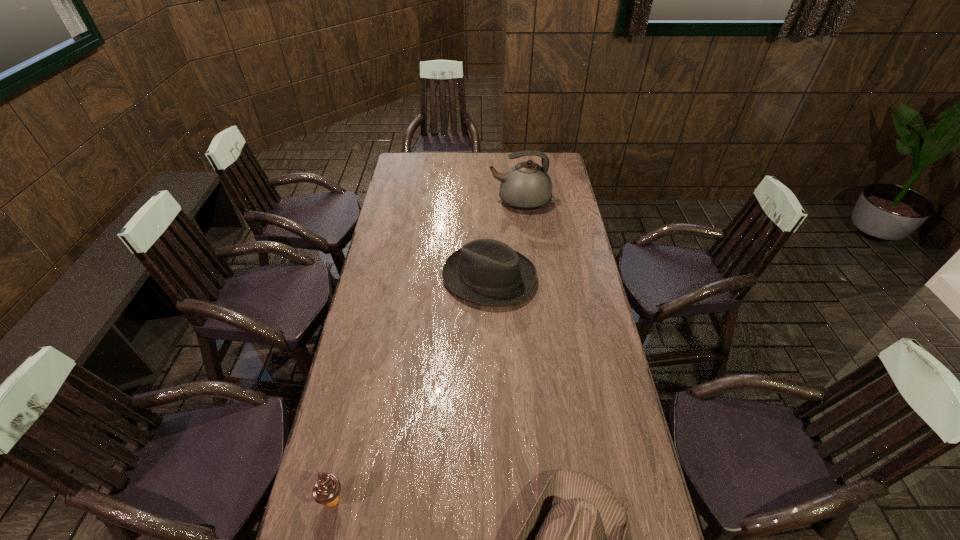
Find the location of a particular element. the farthest object is located at coordinates click(x=526, y=186).

Image resolution: width=960 pixels, height=540 pixels. Find the location of `kettle`. kettle is located at coordinates (526, 186).

Locate an element on the screen. The height and width of the screenshot is (540, 960). the second farthest object is located at coordinates (485, 271).

What are the coordinates of `the leftmost object` in the screenshot? It's located at (326, 489).

Locate an element on the screen. vacant space located at the spout of the farthest object is located at coordinates tap(446, 201).

At what (x,y) coordinates should I click in order to perform the action: click on vacant area situated 0.250m at the spout of the farthest object. Please return your answer as a coordinate pair (x, y). Looking at the image, I should click on (439, 201).

The height and width of the screenshot is (540, 960). I want to click on free space located 0.070m at the spout of the farthest object, so click(474, 201).

Locate an element on the screen. Image resolution: width=960 pixels, height=540 pixels. vacant region located on the right of the second farthest object is located at coordinates (563, 278).

The image size is (960, 540). What are the coordinates of `vacant space located on the back of the leftmost object` in the screenshot? It's located at [341, 468].

Identify the location of object present at the left edge. This screenshot has width=960, height=540. (326, 489).